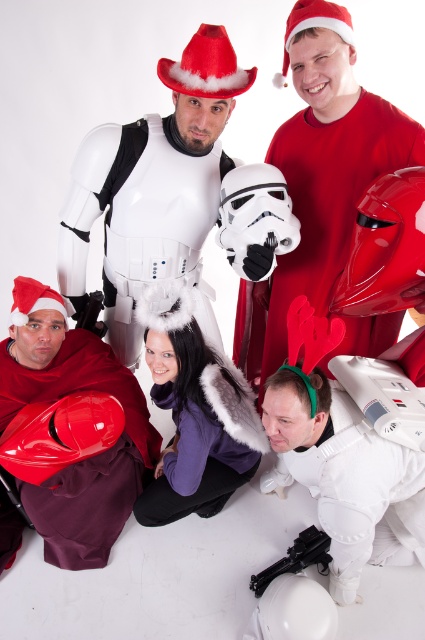
You are standing at the point marked by coordinates point (27, 289) and want to move to the point marked by coordinates point (220, 472). Is there an unobstructed path between these two points?

Point (220, 472) is behind point (27, 289), so there is no unobstructed path between them.